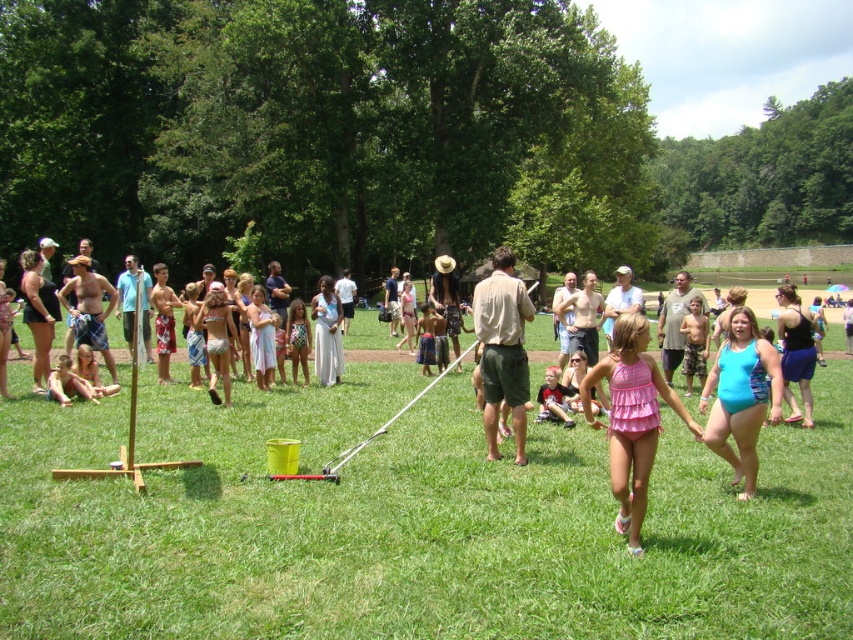
Does green grass at center appear over khaki cotton shirt at center?

No.

What do you see at coordinates (412, 524) in the screenshot?
I see `green grass at center` at bounding box center [412, 524].

Is point (679, 611) positioned before point (506, 380)?

Yes, point (679, 611) is in front of point (506, 380).

Find the location of a particular element. The image size is (853, 640). green grass at center is located at coordinates (412, 524).

Which is below, pink fabric swimsuit at center or khaki cotton shirt at center?

pink fabric swimsuit at center is lower down.

Can you confirm if pink fabric swimsuit at center is thinner than khaki cotton shirt at center?

No, pink fabric swimsuit at center is not thinner than khaki cotton shirt at center.

Is point (643, 353) more distant than point (514, 356)?

No, it is in front of (514, 356).

Image resolution: width=853 pixels, height=640 pixels. What are the coordinates of `pink fabric swimsuit at center` in the screenshot? It's located at (631, 419).

Is green grass at center behind pink fabric swimsuit at center?

That is False.

Who is more forward, (x=151, y=490) or (x=618, y=474)?

Point (x=618, y=474) is more forward.

Identify the location of green grass at center. This screenshot has height=640, width=853. (412, 524).